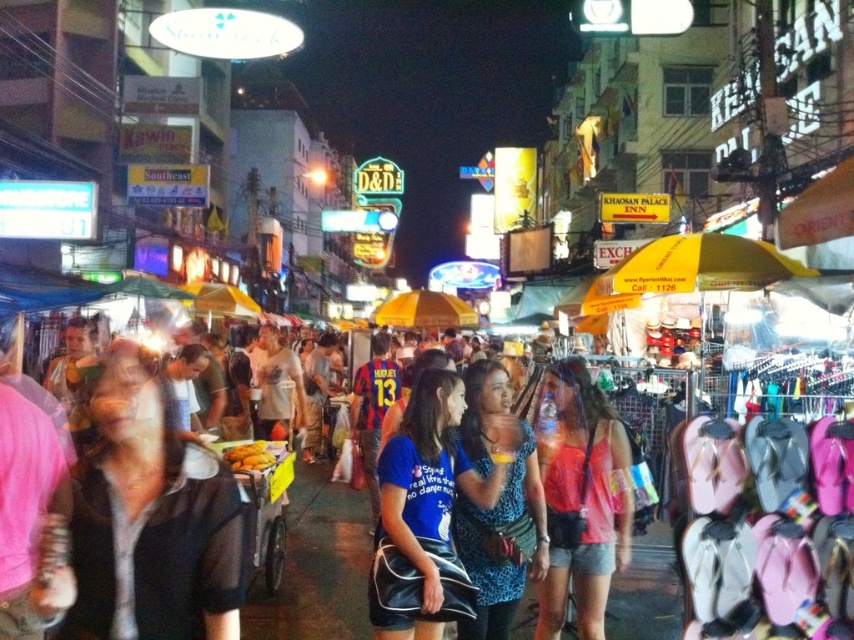
Question: Is matte pink tank top at center to the left of yellow fabric umbrella at center from the viewer's perspective?

Choices:
 (A) no
 (B) yes

Answer: (A)

Question: Which of the following is the closest to the observer?

Choices:
 (A) matte pink tank top at center
 (B) blue printed dress at center

Answer: (A)

Question: Does blue printed dress at center have a smaller size compared to yellow fabric umbrella at center?

Choices:
 (A) no
 (B) yes

Answer: (B)

Question: Does blue printed dress at center come in front of yellow fabric umbrella at center?

Choices:
 (A) yes
 (B) no

Answer: (A)

Question: Estimate the real-world distances between objects in this image. Which object is farther from the blue printed dress at center?

Choices:
 (A) matte pink tank top at center
 (B) yellow fabric umbrella at center

Answer: (B)

Question: Which of the following is the closest to the observer?

Choices:
 (A) blue printed dress at center
 (B) matte pink tank top at center
 (C) yellow fabric umbrella at center

Answer: (B)